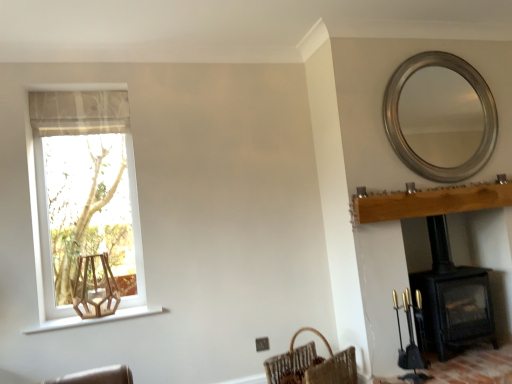
Question: Considering the relative sizes of wooden hexagonal swivel chair at lower left and black matte wood burning stove at lower right in the image provided, is wooden hexagonal swivel chair at lower left taller than black matte wood burning stove at lower right?

Choices:
 (A) yes
 (B) no

Answer: (B)

Question: From the image's perspective, does wooden hexagonal swivel chair at lower left appear lower than black matte wood burning stove at lower right?

Choices:
 (A) no
 (B) yes

Answer: (A)

Question: From a real-world perspective, is wooden hexagonal swivel chair at lower left positioned over black matte wood burning stove at lower right based on gravity?

Choices:
 (A) yes
 (B) no

Answer: (A)

Question: Is wooden hexagonal swivel chair at lower left further to the viewer compared to black matte wood burning stove at lower right?

Choices:
 (A) no
 (B) yes

Answer: (A)

Question: From the image's perspective, is wooden hexagonal swivel chair at lower left located above black matte wood burning stove at lower right?

Choices:
 (A) yes
 (B) no

Answer: (A)

Question: Based on their positions, is light brown wood mantle at upper right located to the left or right of brown woven basket at lower right?

Choices:
 (A) right
 (B) left

Answer: (A)

Question: Considering the positions of light brown wood mantle at upper right and brown woven basket at lower right in the image, is light brown wood mantle at upper right bigger or smaller than brown woven basket at lower right?

Choices:
 (A) big
 (B) small

Answer: (B)

Question: Looking at their shapes, would you say light brown wood mantle at upper right is wider or thinner than brown woven basket at lower right?

Choices:
 (A) wide
 (B) thin

Answer: (B)

Question: Is light brown wood mantle at upper right situated inside brown woven basket at lower right or outside?

Choices:
 (A) inside
 (B) outside

Answer: (B)

Question: Considering the positions of point (413, 150) and point (75, 309), is point (413, 150) closer or farther from the camera than point (75, 309)?

Choices:
 (A) closer
 (B) farther

Answer: (B)

Question: Choose the correct answer: Is silver metallic mirror at upper right inside wooden hexagonal swivel chair at lower left or outside it?

Choices:
 (A) outside
 (B) inside

Answer: (A)

Question: In terms of width, does silver metallic mirror at upper right look wider or thinner when compared to wooden hexagonal swivel chair at lower left?

Choices:
 (A) thin
 (B) wide

Answer: (A)

Question: In the image, is silver metallic mirror at upper right on the left side or the right side of wooden hexagonal swivel chair at lower left?

Choices:
 (A) right
 (B) left

Answer: (A)

Question: Is silver metallic mirror at upper right inside or outside of black matte wood burning stove at lower right?

Choices:
 (A) outside
 (B) inside

Answer: (A)

Question: From a real-world perspective, is silver metallic mirror at upper right positioned above or below black matte wood burning stove at lower right?

Choices:
 (A) below
 (B) above

Answer: (B)